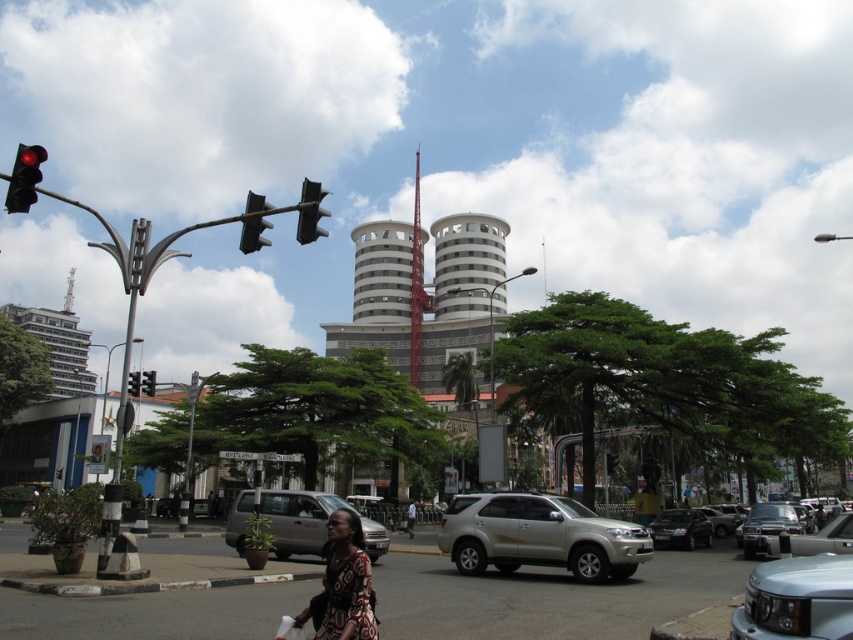
Question: Which is farther from the shiny black sedan at center?

Choices:
 (A) satin gold suv at center
 (B) black glass traffic light at upper left
 (C) silver metallic van at center
 (D) matte black traffic light at upper left

Answer: (B)

Question: Can you confirm if metallic traffic light at upper center is positioned below brown textured dress at center?

Choices:
 (A) no
 (B) yes

Answer: (A)

Question: Which object is closer to the camera taking this photo?

Choices:
 (A) black plastic traffic light at left
 (B) satin gold suv at center
 (C) white textured building at center
 (D) metallic traffic light at upper center

Answer: (D)

Question: Is the position of satin silver suv at lower right less distant than that of black glass traffic light at upper left?

Choices:
 (A) yes
 (B) no

Answer: (A)

Question: Does satin silver suv at lower right have a lesser width compared to metallic traffic light at upper center?

Choices:
 (A) no
 (B) yes

Answer: (B)

Question: Which point appears farthest from the camera in this image?

Choices:
 (A) (709, 532)
 (B) (148, 381)
 (C) (409, 506)
 (D) (281, 532)

Answer: (C)